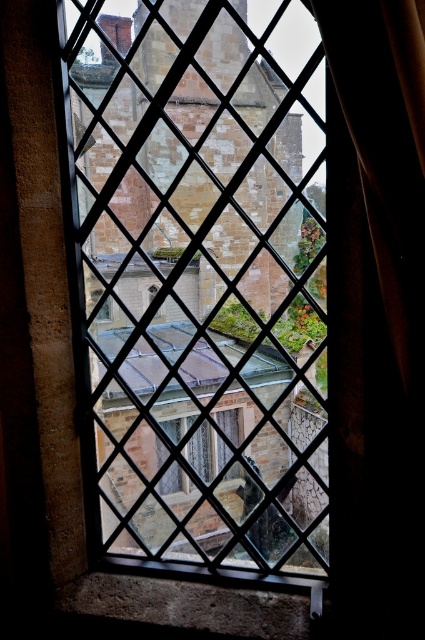
You are standing 30 meters away from the camera position. Can you see the brown stone tower at center from your current position?

The brown stone tower at center is 36.04 meters away from the camera. Since you are 30 meters away from the camera position, you are closer to the tower than the camera. Therefore, you can see the brown stone tower at center from your current position.

You are standing in a room and want to look outside through the window. There is a black fabric curtain at right and a clear glass window at center. Which one allows you to see more of the outside view?

The clear glass window at center allows you to see more of the outside view because it has a greater width than the black fabric curtain at right.